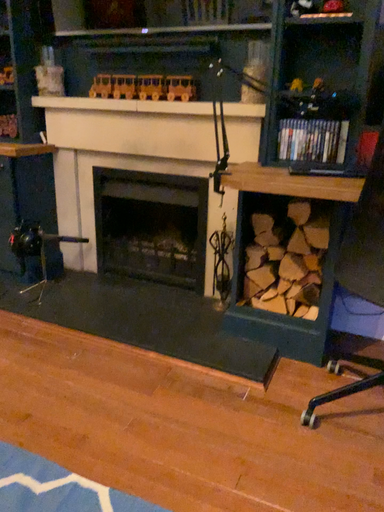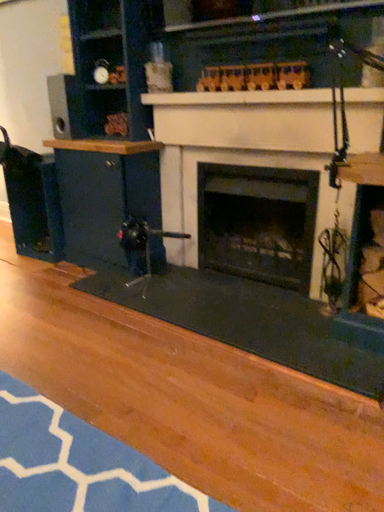
Question: Which way did the camera rotate in the video?

Choices:
 (A) rotated left
 (B) rotated right

Answer: (A)